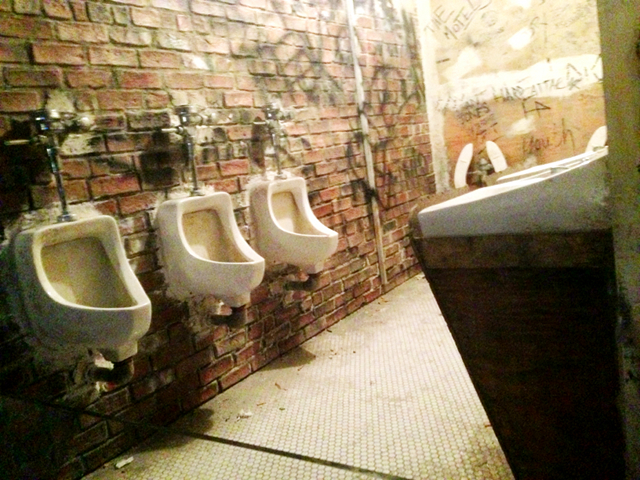
Find the location of a particular element. The width and height of the screenshot is (640, 480). toilet flusher is located at coordinates (25, 143), (164, 133), (260, 116).